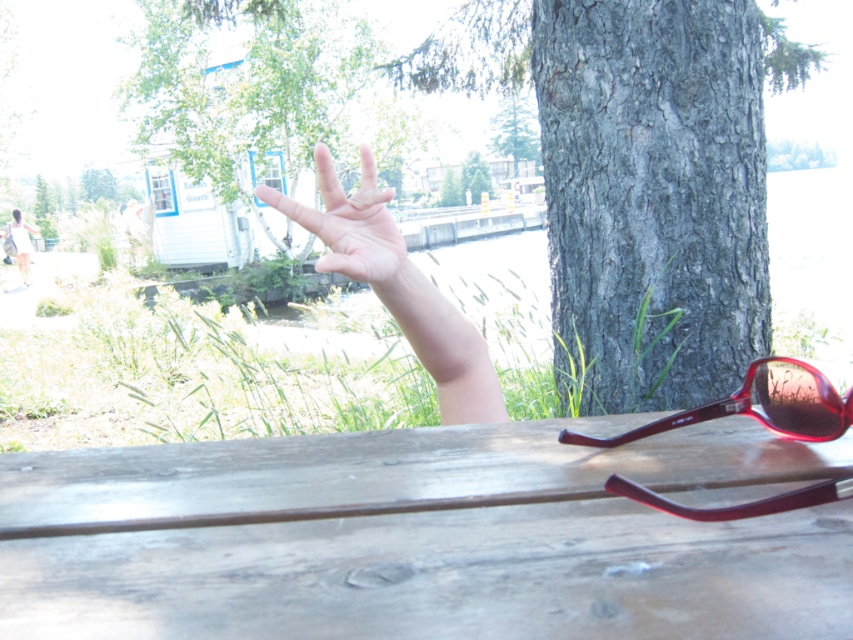
Question: Can you confirm if wooden table at center is positioned above shiny red plastic sunglasses at lower right?

Choices:
 (A) yes
 (B) no

Answer: (B)

Question: Which object is the closest to the pale skin hand at center?

Choices:
 (A) green rough bark tree at upper center
 (B) white fabric shirt at upper left
 (C) shiny red plastic sunglasses at lower right

Answer: (C)

Question: Which point appears closest to the camera in this image?

Choices:
 (A) (437, 600)
 (B) (809, 156)
 (C) (502, 67)

Answer: (A)

Question: Is the position of green rough bark tree at upper center more distant than that of smooth gray bark at center?

Choices:
 (A) no
 (B) yes

Answer: (A)

Question: Is white cotton dress at left above white fabric shirt at upper left?

Choices:
 (A) no
 (B) yes

Answer: (A)

Question: Which object is closer to the camera taking this photo?

Choices:
 (A) pale skin hand at center
 (B) white cotton dress at left
 (C) green rough bark tree at upper center
 (D) smooth gray bark at center

Answer: (A)